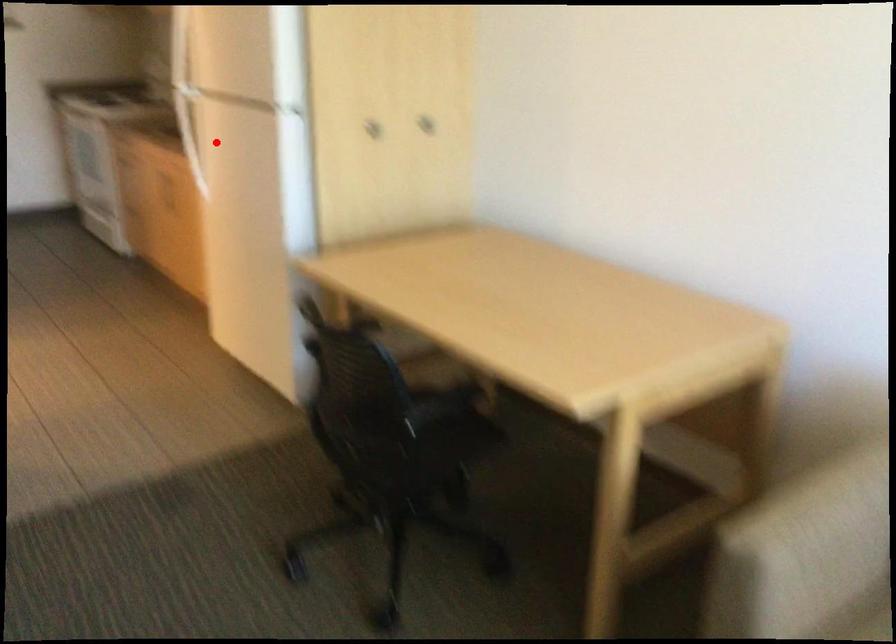
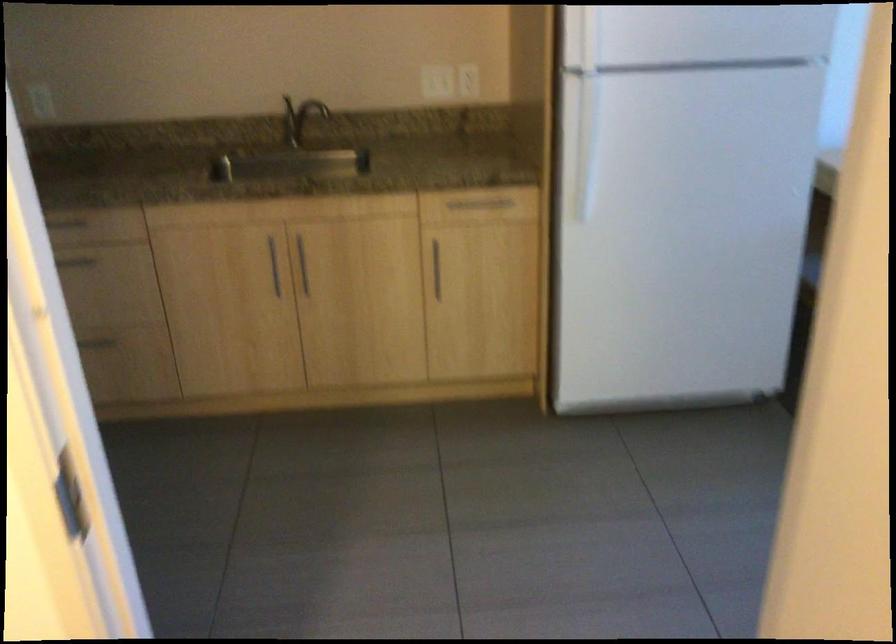
Locate, in the second image, the point that corresponds to the highlighted location in the first image.

(586, 146)